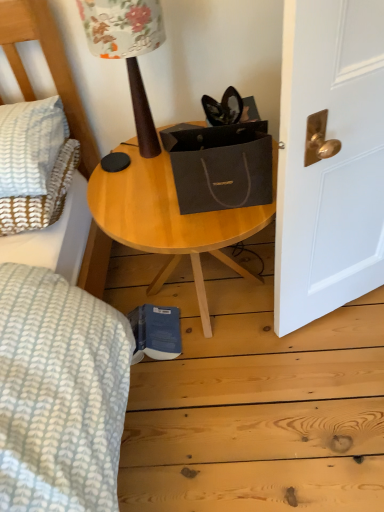
Locate an element on the screen. The width and height of the screenshot is (384, 512). white textured pillow at left is located at coordinates pyautogui.click(x=30, y=145).

What is the approximate height of wooden table at center?

wooden table at center is 22.04 inches in height.

Find the location of a particular element. Image resolution: width=384 pixels, height=512 pixels. white textured pillow at left is located at coordinates (30, 145).

Locate an element on the screen. The width and height of the screenshot is (384, 512). pillow on the left of wooden table at center is located at coordinates (30, 145).

Does wooden table at center have a lesser width compared to white textured pillow at left?

In fact, wooden table at center might be wider than white textured pillow at left.

From the image's perspective, is wooden table at center above white textured pillow at left?

No, from the image's perspective, wooden table at center is not over white textured pillow at left.

Is wooden table at center to the right of wooden table lamp at upper center from the viewer's perspective?

Correct, you'll find wooden table at center to the right of wooden table lamp at upper center.

Can you tell me how much wooden table at center and wooden table lamp at upper center differ in facing direction?

The angle between the facing direction of wooden table at center and the facing direction of wooden table lamp at upper center is 1.93 degrees.

Considering the sizes of objects wooden table at center and wooden table lamp at upper center in the image provided, who is shorter, wooden table at center or wooden table lamp at upper center?

wooden table lamp at upper center is shorter.

Are wooden table at center and wooden table lamp at upper center located far from each other?

wooden table at center is near wooden table lamp at upper center, not far away.

Is the position of wooden table lamp at upper center less distant than that of white textured pillow at left?

Yes, the depth of wooden table lamp at upper center is less than that of white textured pillow at left.

Do you think wooden table lamp at upper center is within white textured pillow at left, or outside of it?

wooden table lamp at upper center is not inside white textured pillow at left, it's outside.

Is wooden table lamp at upper center looking in the opposite direction of white textured pillow at left?

No.

Does point (146, 123) come farther from viewer compared to point (30, 126)?

Yes, point (146, 123) is behind point (30, 126).

Would you consider white textured pillow at left to be distant from wooden table at center?

No.

Which of these two, white textured pillow at left or wooden table at center, is smaller?

white textured pillow at left is smaller.

From the image's perspective, which is above, white textured pillow at left or wooden table at center?

From the image's view, white textured pillow at left is above.

Is white textured pillow at left further to camera compared to wooden table at center?

Yes, white textured pillow at left is behind wooden table at center.

Consider the image. Does white textured pillow at left have a larger size compared to wooden table lamp at upper center?

Incorrect, white textured pillow at left is not larger than wooden table lamp at upper center.

Which point is more distant from viewer, (x=63, y=126) or (x=83, y=24)?

The point (x=63, y=126) is farther.

In the scene shown: Is wooden table lamp at upper center at the back of white textured pillow at left?

No.

Does white textured pillow at left have a greater height compared to wooden table lamp at upper center?

In fact, white textured pillow at left may be shorter than wooden table lamp at upper center.

Could you tell me if wooden table lamp at upper center is turned towards wooden table at center?

No, wooden table lamp at upper center is not facing towards wooden table at center.

Who is taller, wooden table lamp at upper center or wooden table at center?

wooden table at center.

Find the location of a particular element. This screenshot has height=512, width=384. table lamp above the wooden table at center (from the image's perspective) is located at coordinates (127, 50).

From the picture: Are wooden table lamp at upper center and wooden table at center located far from each other?

wooden table lamp at upper center is actually quite close to wooden table at center.

Find the location of a particular element. pillow behind the wooden table at center is located at coordinates (30, 145).

Identify the location of table on the right side of wooden table lamp at upper center. (162, 224).

When comparing their distances from white textured pillow at left, does wooden table at center or wooden table lamp at upper center seem closer?

Based on the image, wooden table at center appears to be nearer to white textured pillow at left.

Looking at the image, which one is located closer to white textured pillow at left, wooden table lamp at upper center or wooden table at center?

wooden table at center.

In the scene shown: Looking at the image, which one is located closer to wooden table lamp at upper center, white textured pillow at left or wooden table at center?

Among the two, wooden table at center is located nearer to wooden table lamp at upper center.

Which object lies nearer to the anchor point wooden table lamp at upper center, wooden table at center or white textured pillow at left?

Based on the image, wooden table at center appears to be nearer to wooden table lamp at upper center.

Which object lies nearer to the anchor point wooden table at center, wooden table lamp at upper center or white textured pillow at left?

The object closer to wooden table at center is wooden table lamp at upper center.

From the image, which object appears to be nearer to wooden table at center, white textured pillow at left or wooden table lamp at upper center?

Based on the image, wooden table lamp at upper center appears to be nearer to wooden table at center.

The height and width of the screenshot is (512, 384). In order to click on table lamp located between white textured pillow at left and wooden table at center in the left-right direction in this screenshot , I will do `click(127, 50)`.